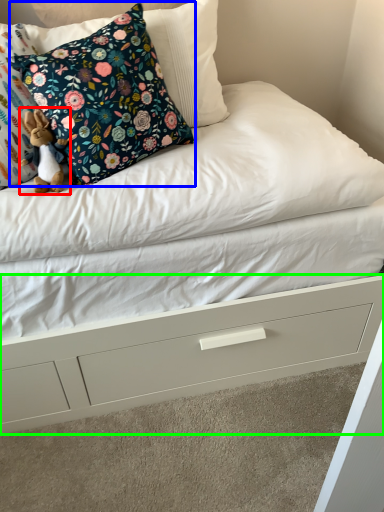
Question: Which object is the farthest from toy (highlighted by a red box)? Choose among these: pillow (highlighted by a blue box) or drawer (highlighted by a green box).

Choices:
 (A) pillow
 (B) drawer

Answer: (B)